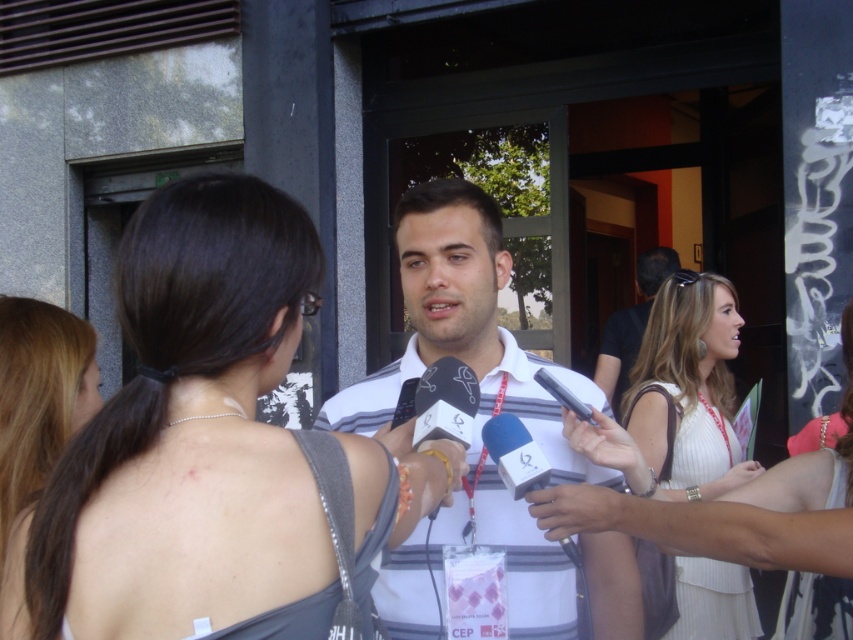
Question: Is white striped shirt at center below white textured dress at center?

Choices:
 (A) yes
 (B) no

Answer: (B)

Question: Is smooth gray dress at center bigger than white textured dress at center?

Choices:
 (A) no
 (B) yes

Answer: (A)

Question: Does blonde hair at center come in front of black striped shirt at center?

Choices:
 (A) yes
 (B) no

Answer: (A)

Question: Among these points, which one is nearest to the camera?

Choices:
 (A) (561, 488)
 (B) (607, 388)
 (C) (717, 563)
 (D) (201, 401)

Answer: (D)

Question: Among these points, which one is farthest from the camera?

Choices:
 (A) (421, 490)
 (B) (601, 442)
 (C) (445, 221)

Answer: (C)

Question: Which of the following is the farthest from the observer?

Choices:
 (A) white knit dress at center
 (B) smooth gray dress at center
 (C) blonde hair at center

Answer: (A)